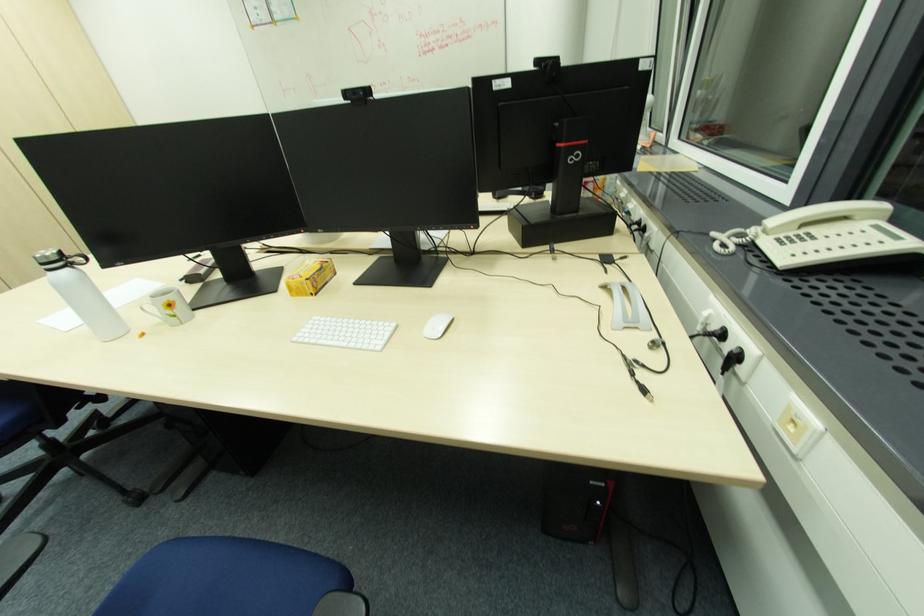
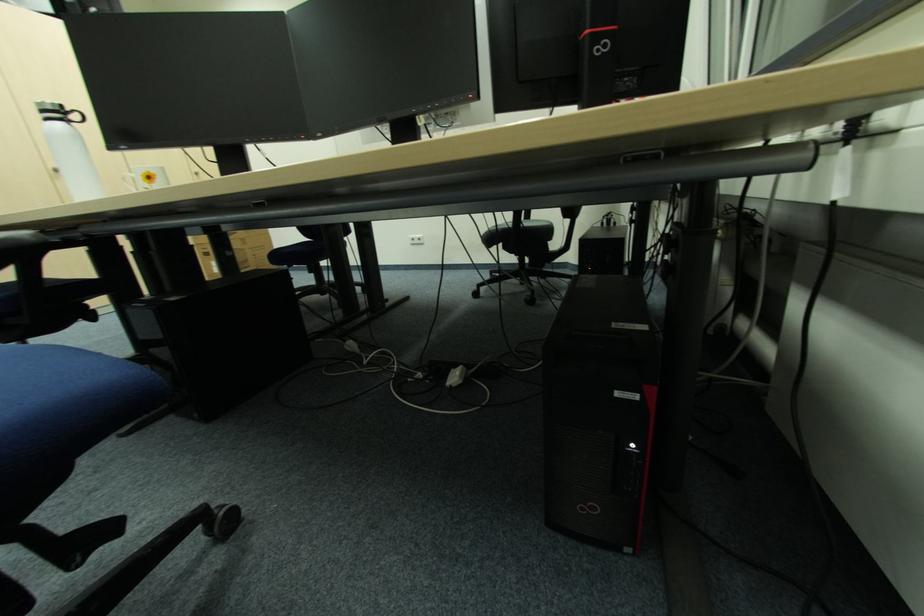
The images are taken continuously from a first-person perspective. In which direction are you moving?

The movement direction of the cameraman is right, forward.